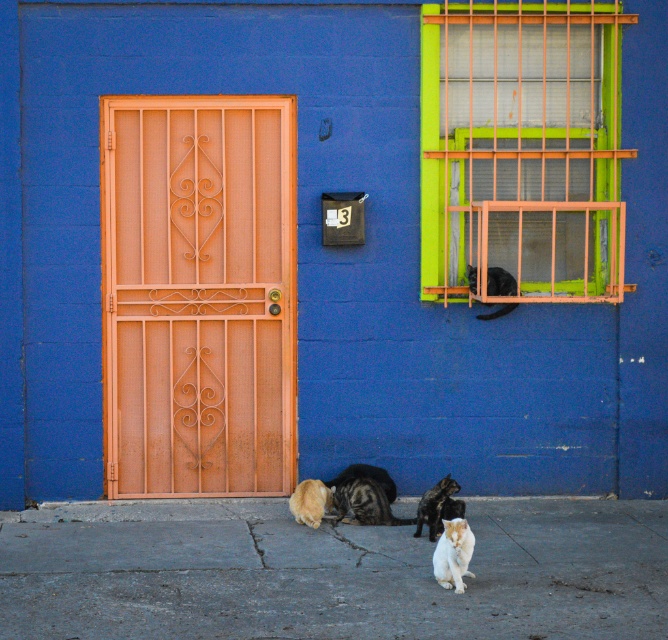
Question: Among these objects, which one is farthest from the camera?

Choices:
 (A) striped fur cat at lower center
 (B) fluffy golden cat at lower center
 (C) white fluffy cat at lower center

Answer: (A)

Question: In this image, where is fluffy golden cat at lower center located relative to black fur cat at upper right?

Choices:
 (A) left
 (B) right

Answer: (A)

Question: Is tabby fur cat at center further to camera compared to striped fur cat at lower center?

Choices:
 (A) yes
 (B) no

Answer: (B)

Question: Which object is farther from the camera taking this photo?

Choices:
 (A) white fluffy cat at lower center
 (B) rusty metal door at left
 (C) tabby fur cat at center
 (D) striped fur cat at lower center

Answer: (D)

Question: Where is gray concrete pavement at lower center located in relation to tabby fur cat at center in the image?

Choices:
 (A) above
 (B) below

Answer: (B)

Question: Which object is positioned closest to the striped fur cat at lower center?

Choices:
 (A) fluffy white cat at center
 (B) fluffy golden cat at lower center

Answer: (B)